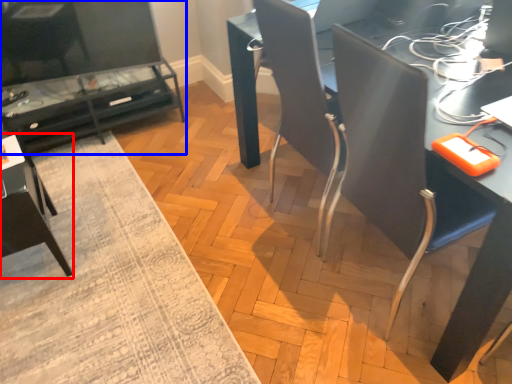
Question: Which of the following is the closest to the observer, armchair (highlighted by a red box) or table (highlighted by a blue box)?

Choices:
 (A) armchair
 (B) table

Answer: (A)